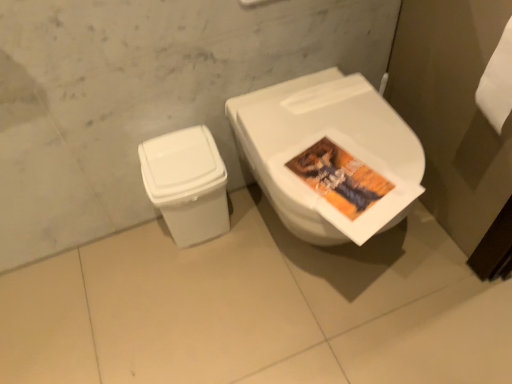
Find the location of a particular element. The image size is (512, 384). free space in front of white glossy toilet at center is located at coordinates (346, 339).